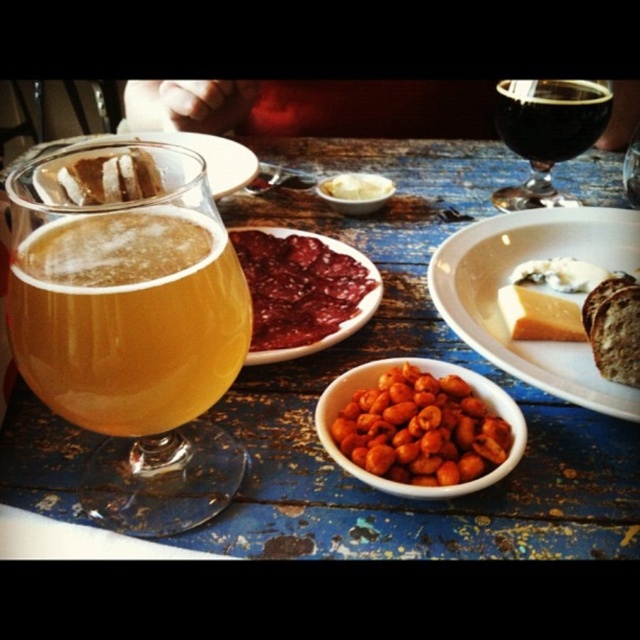
You are a guest at this table and want to reach for the smooth red jam at center without moving the amber glass at left. Is this possible?

Yes, the smooth red jam at center is to the right of the amber glass at left, so you can reach it without disturbing the glass.

You are a chef who needs to place a 10.5 inch diameter platter on the table. You see the white matte plate at center. Can you determine if the platter will fit on the table without overlapping any other items?

The white matte plate at center is 10.39 inches away from the viewer. Since the platter is 10.5 inches in diameter, it might not fit if the plate is already occupying that space. However, the distance alone doesn

You are a photographer setting up a shot of the wooden table at center and the dark glass wine at upper right. Which object should you focus on first to ensure both are in sharp focus?

Result: You should focus on the wooden table at center first because it is closer to you than the dark glass wine at upper right, so adjusting focus from near to far will help both be in sharp focus.